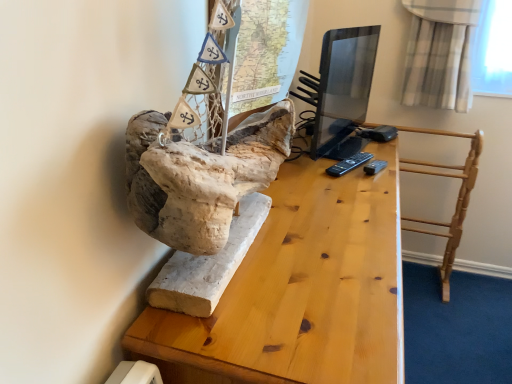
Question: Is matte black monitor at center far away from natural wood table at center?

Choices:
 (A) no
 (B) yes

Answer: (B)

Question: Is the depth of matte black monitor at center greater than that of natural wood table at center?

Choices:
 (A) yes
 (B) no

Answer: (A)

Question: From a real-world perspective, is matte black monitor at center physically below natural wood table at center?

Choices:
 (A) no
 (B) yes

Answer: (A)

Question: From the image's perspective, does matte black monitor at center appear lower than natural wood table at center?

Choices:
 (A) no
 (B) yes

Answer: (A)

Question: Is matte black monitor at center outside natural wood table at center?

Choices:
 (A) yes
 (B) no

Answer: (A)

Question: Is matte black monitor at center positioned with its back to natural wood table at center?

Choices:
 (A) yes
 (B) no

Answer: (B)

Question: Considering the relative positions of matte black monitor at center and light wood/rough table at center in the image provided, is matte black monitor at center to the left of light wood/rough table at center from the viewer's perspective?

Choices:
 (A) no
 (B) yes

Answer: (B)

Question: Is matte black monitor at center beside light wood/rough table at center?

Choices:
 (A) no
 (B) yes

Answer: (A)

Question: Is matte black monitor at center outside light wood/rough table at center?

Choices:
 (A) no
 (B) yes

Answer: (B)

Question: From the image's perspective, would you say matte black monitor at center is shown under light wood/rough table at center?

Choices:
 (A) yes
 (B) no

Answer: (B)

Question: Does matte black monitor at center appear on the right side of light wood/rough table at center?

Choices:
 (A) no
 (B) yes

Answer: (A)

Question: From a real-world perspective, is matte black monitor at center over light wood/rough table at center?

Choices:
 (A) yes
 (B) no

Answer: (A)

Question: Is light wood/rough table at center bigger than natural wood table at center?

Choices:
 (A) yes
 (B) no

Answer: (B)